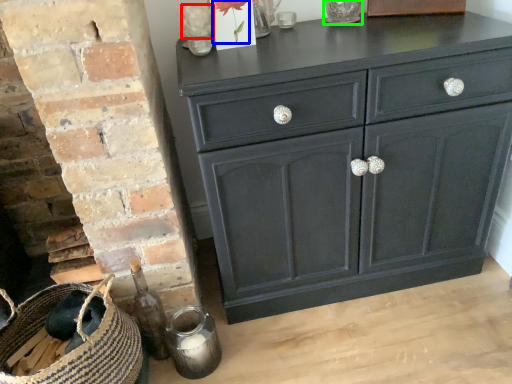
Question: Which object is positioned farthest from flower (highlighted by a red box)? Select from flower (highlighted by a blue box) and glass vase (highlighted by a green box).

Choices:
 (A) flower
 (B) glass vase

Answer: (B)